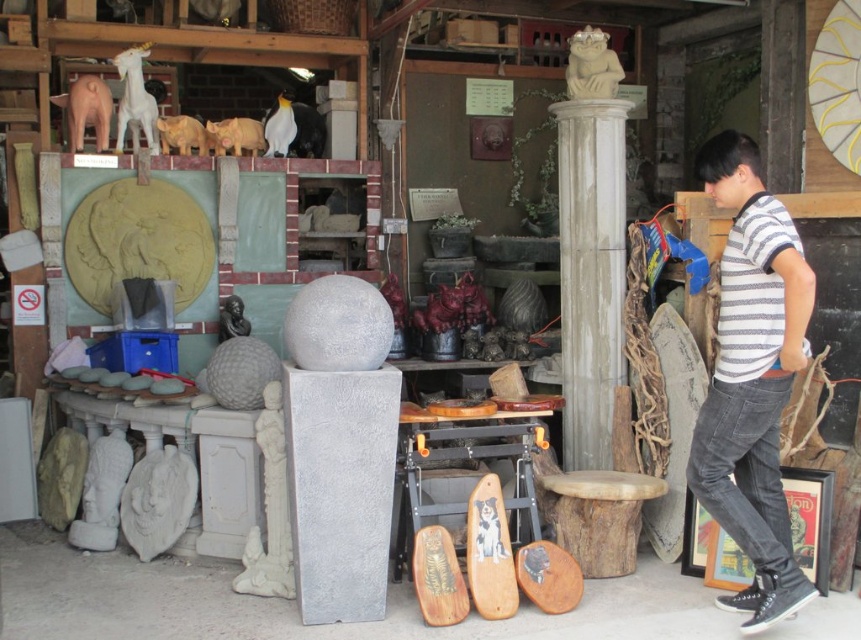
Can you confirm if white stone shield at lower left is taller than matte yellow statue at upper left?

Indeed, white stone shield at lower left has a greater height compared to matte yellow statue at upper left.

Is white stone shield at lower left further to the viewer compared to matte yellow statue at upper left?

No, it is not.

Is point (140, 545) behind point (208, 141)?

No, it is not.

Find the location of a particular element. This screenshot has width=861, height=640. white stone shield at lower left is located at coordinates (158, 500).

Between point (785, 333) and point (135, 97), which one is positioned behind?

The point (135, 97) is more distant.

Between striped cotton shirt at right and white glossy unicorn at upper left, which one is positioned higher?

Positioned higher is white glossy unicorn at upper left.

The image size is (861, 640). Describe the element at coordinates (753, 378) in the screenshot. I see `striped cotton shirt at right` at that location.

Where is `striped cotton shirt at right`? striped cotton shirt at right is located at coordinates (753, 378).

Between white glossy unicorn at upper left and matte yellow statue at upper left, which one has more height?

Standing taller between the two is white glossy unicorn at upper left.

Who is more distant from viewer, (135, 108) or (170, 125)?

The point (170, 125) is behind.

The width and height of the screenshot is (861, 640). Identify the location of white glossy unicorn at upper left. (135, 100).

Find the location of a particular element. The image size is (861, 640). white glossy unicorn at upper left is located at coordinates (135, 100).